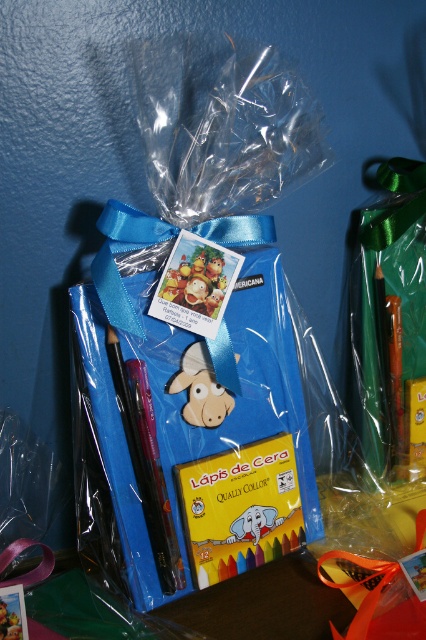
Which is behind, point (186, 372) or point (204, 253)?

The point (186, 372) is more distant.

In the scene shown: Who is positioned more to the right, wooden donkey at center or matte plastic toy at center?

Positioned to the right is wooden donkey at center.

The image size is (426, 640). What are the coordinates of `wooden donkey at center` in the screenshot? It's located at (199, 388).